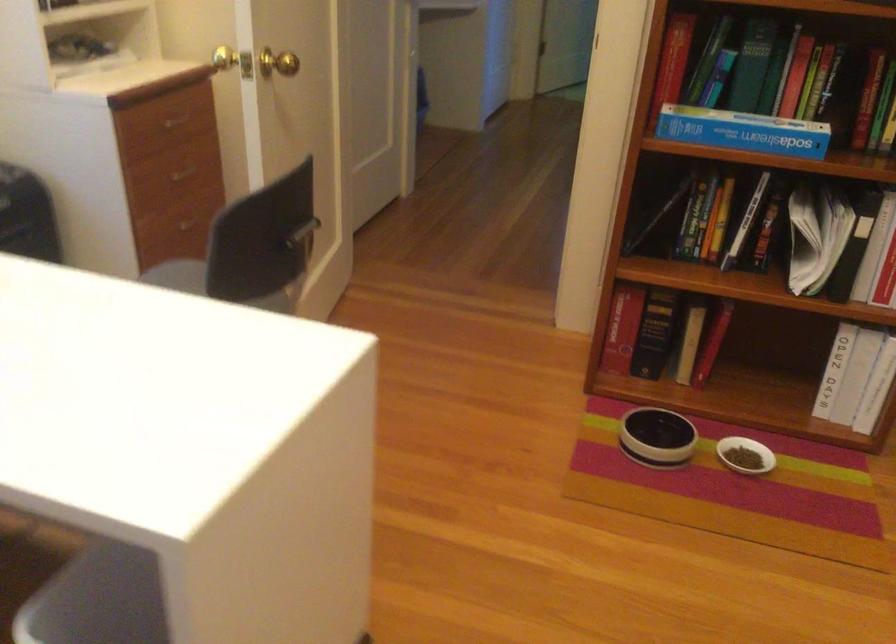
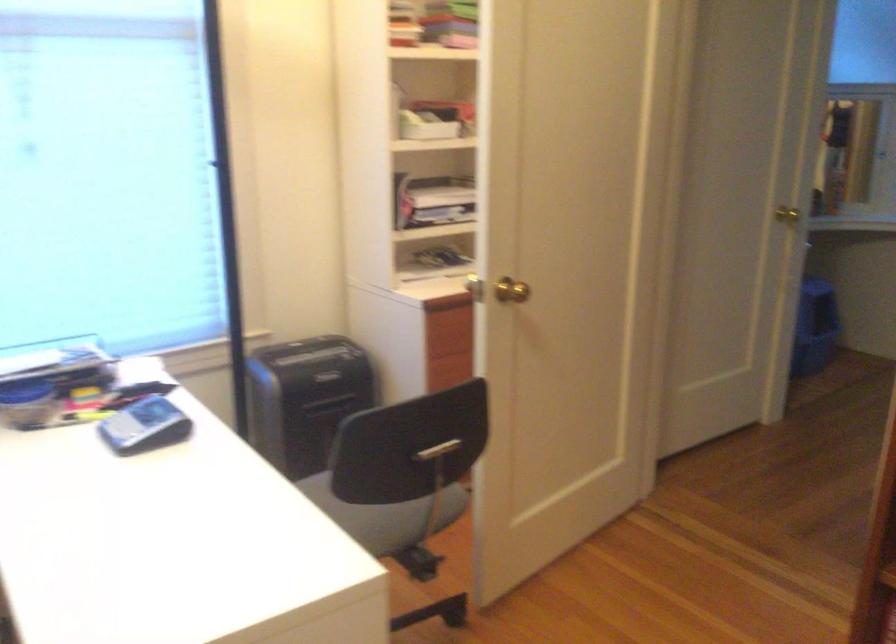
Question: The camera is either moving clockwise (left) or counter-clockwise (right) around the object. The first image is from the beginning of the video and the second image is from the end. Is the camera moving left or right when shooting the video?

Choices:
 (A) Left
 (B) Right

Answer: (B)